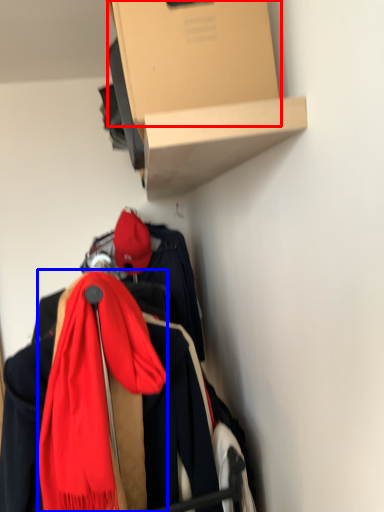
Question: Among these objects, which one is farthest to the camera, cardboard box (highlighted by a red box) or scarf (highlighted by a blue box)?

Choices:
 (A) cardboard box
 (B) scarf

Answer: (B)